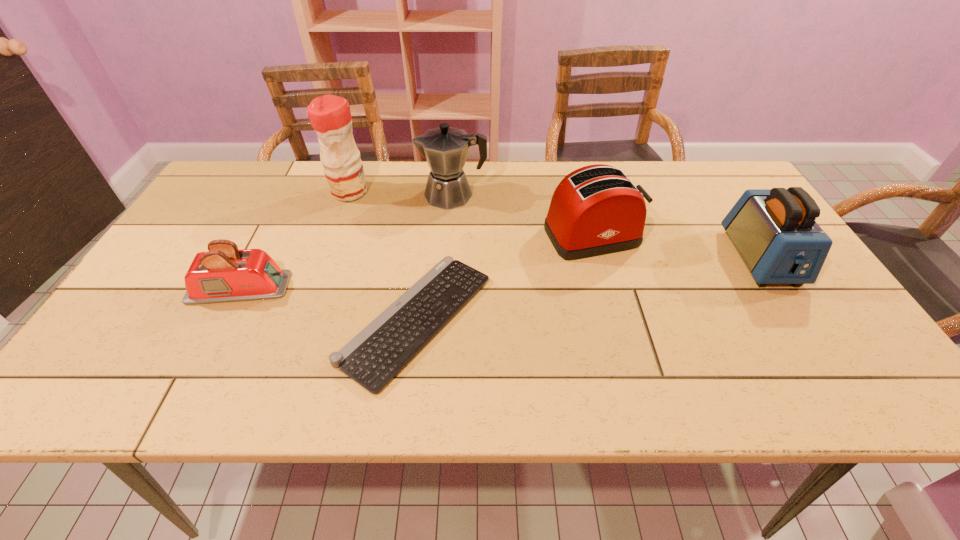
At what (x,y) coordinates should I click in order to perform the action: click on object that is at the right edge. Please return your answer as a coordinate pair (x, y). The height and width of the screenshot is (540, 960). Looking at the image, I should click on (774, 230).

In the image, there is a desktop. Where is `vacant space at the far edge`? The width and height of the screenshot is (960, 540). vacant space at the far edge is located at coordinates (568, 172).

I want to click on vacant area at the near edge of the desktop, so click(608, 367).

Identify the location of free space at the near left corner of the desktop. (71, 395).

Where is `vacant area between the shortest object and the rightmost object`? This screenshot has height=540, width=960. vacant area between the shortest object and the rightmost object is located at coordinates (588, 288).

Where is `free spot between the leftmost toaster and the shortest object`? This screenshot has width=960, height=540. free spot between the leftmost toaster and the shortest object is located at coordinates (328, 303).

Identify the location of free spot between the coffeepot and the computer keyboard. The width and height of the screenshot is (960, 540). (435, 257).

At what (x,y) coordinates should I click in order to perform the action: click on empty space that is in between the shortest object and the rightmost toaster. Please return your answer as a coordinate pair (x, y). Looking at the image, I should click on (588, 288).

The width and height of the screenshot is (960, 540). In order to click on empty location between the coffeepot and the tallest object in this screenshot , I will do [400, 193].

Locate an element on the screen. vacant space that's between the second toaster from right to left and the rightmost object is located at coordinates (677, 247).